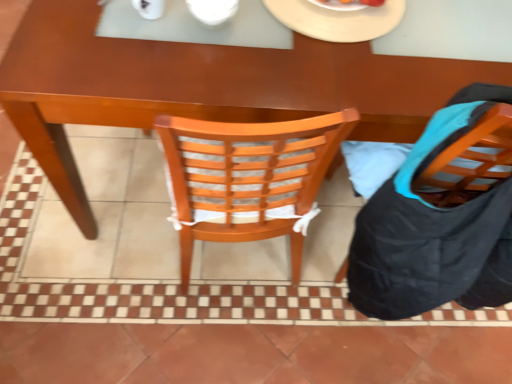
Question: From their relative heights in the image, would you say white matte plate at upper center is taller or shorter than white glossy bowl at upper center?

Choices:
 (A) short
 (B) tall

Answer: (A)

Question: In terms of size, does white matte plate at upper center appear bigger or smaller than white glossy bowl at upper center?

Choices:
 (A) big
 (B) small

Answer: (A)

Question: Estimate the real-world distances between objects in this image. Which object is farther from the white glossy bowl at upper center?

Choices:
 (A) wooden chair at right
 (B) white matte plate at upper center
 (C) brown wooden desk at center

Answer: (A)

Question: Considering the real-world distances, which object is closest to the brown wooden desk at center?

Choices:
 (A) white glossy bowl at upper center
 (B) wooden chair at right
 (C) white matte plate at upper center

Answer: (C)